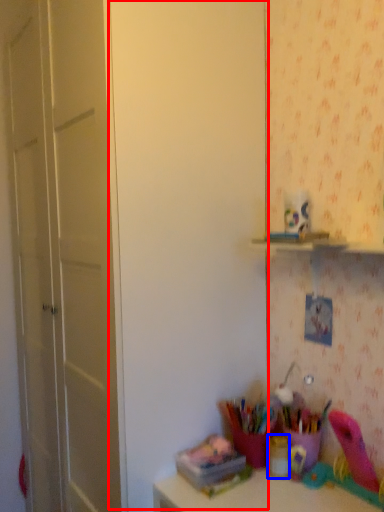
Question: Which object is closer to the camera taking this photo, door (highlighted by a red box) or stationery (highlighted by a blue box)?

Choices:
 (A) door
 (B) stationery

Answer: (A)